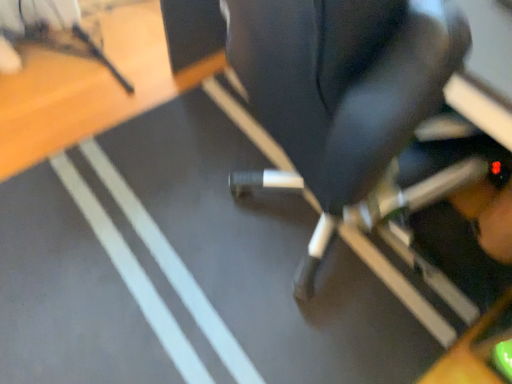
Describe the element at coordinates (343, 87) in the screenshot. This screenshot has height=384, width=512. I see `black leather swivel chair at center` at that location.

You are a GUI agent. You are given a task and a screenshot of the screen. Output one action in this format:
    pyautogui.click(x=<x>, y=<y>)
    Task: Click on the black leather swivel chair at center
    This screenshot has height=384, width=512.
    Given the screenshot: What is the action you would take?
    pyautogui.click(x=343, y=87)

At what (x,y) coordinates should I click in order to perform the action: click on black leather swivel chair at center. Please return your answer as a coordinate pair (x, y). This screenshot has height=384, width=512. Looking at the image, I should click on (343, 87).